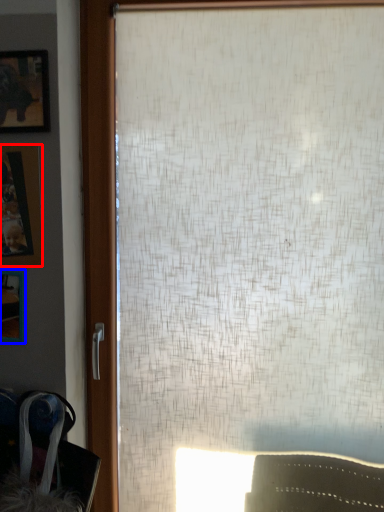
Question: Among these objects, which one is farthest to the camera, picture frame (highlighted by a red box) or picture frame (highlighted by a blue box)?

Choices:
 (A) picture frame
 (B) picture frame

Answer: (B)